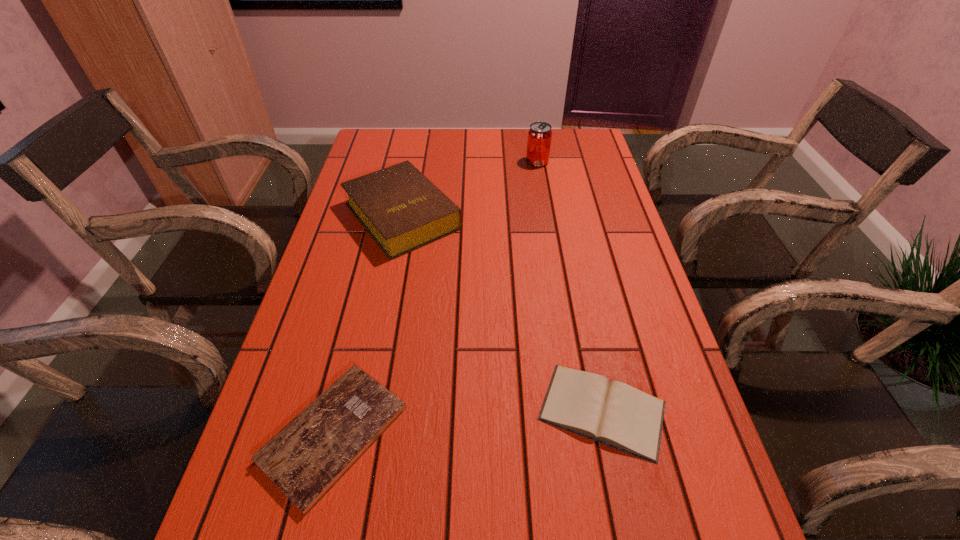
The width and height of the screenshot is (960, 540). I want to click on the tallest object, so [x=539, y=135].

The width and height of the screenshot is (960, 540). Identify the location of pop soda. (539, 135).

The height and width of the screenshot is (540, 960). Identify the location of the second tallest object. (401, 209).

Identify the location of the farthest Bible. (401, 209).

Locate an element on the screen. The height and width of the screenshot is (540, 960). the rightmost Bible is located at coordinates point(613,413).

Locate an element on the screen. The image size is (960, 540). blank area located on the right of the pop soda is located at coordinates (588, 162).

Identify the location of free space located 0.170m on the right of the tallest Bible. (523, 216).

Image resolution: width=960 pixels, height=540 pixels. I want to click on free space located on the back of the rightmost Bible, so click(577, 287).

The height and width of the screenshot is (540, 960). Identify the location of object at the far edge. (539, 135).

Where is `object positioned at the right edge`? object positioned at the right edge is located at coordinates (613, 413).